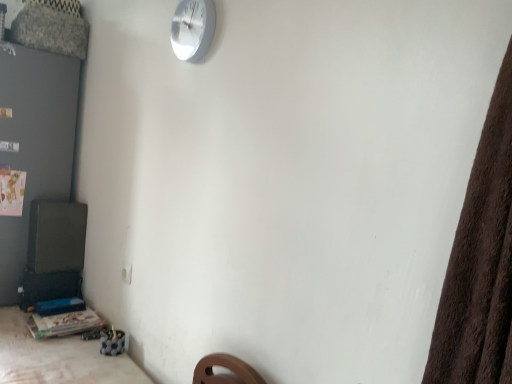
Question: Is white metallic wall clock at upper center directly adjacent to wooden table at lower left?

Choices:
 (A) no
 (B) yes

Answer: (A)

Question: Is white metallic wall clock at upper center further to camera compared to wooden table at lower left?

Choices:
 (A) no
 (B) yes

Answer: (A)

Question: Does white metallic wall clock at upper center have a greater height compared to wooden table at lower left?

Choices:
 (A) no
 (B) yes

Answer: (B)

Question: Are white metallic wall clock at upper center and wooden table at lower left far apart?

Choices:
 (A) yes
 (B) no

Answer: (A)

Question: Does white metallic wall clock at upper center have a greater width compared to wooden table at lower left?

Choices:
 (A) yes
 (B) no

Answer: (B)

Question: From a real-world perspective, does white metallic wall clock at upper center stand above wooden table at lower left?

Choices:
 (A) yes
 (B) no

Answer: (A)

Question: From the image's perspective, is wooden table at lower left on wooden table at lower left?

Choices:
 (A) no
 (B) yes

Answer: (B)

Question: From the image's perspective, is wooden table at lower left beneath wooden table at lower left?

Choices:
 (A) yes
 (B) no

Answer: (B)

Question: Does wooden table at lower left appear on the left side of wooden table at lower left?

Choices:
 (A) yes
 (B) no

Answer: (A)

Question: Is wooden table at lower left directly adjacent to wooden table at lower left?

Choices:
 (A) yes
 (B) no

Answer: (B)

Question: Is wooden table at lower left surrounded by wooden table at lower left?

Choices:
 (A) no
 (B) yes

Answer: (A)

Question: Does wooden table at lower left have a greater height compared to wooden table at lower left?

Choices:
 (A) no
 (B) yes

Answer: (A)

Question: Is wooden table at lower left taller than white metallic wall clock at upper center?

Choices:
 (A) yes
 (B) no

Answer: (A)